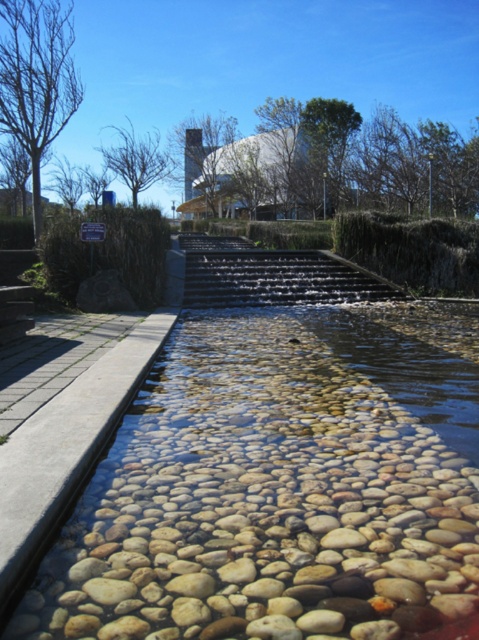
Between point (257, 508) and point (237, 236), which one is positioned in front?

Positioned in front is point (257, 508).

Between point (216, 417) and point (182, 234), which one is positioned behind?

The point (182, 234) is behind.

Who is more forward, (120, 557) or (283, 253)?

Point (120, 557) is in front.

Where is `translucent pebbles at center`? This screenshot has height=640, width=479. translucent pebbles at center is located at coordinates (273, 492).

Is black stone stairs at center thinner than smooth concrete stairs at lower left?

In fact, black stone stairs at center might be wider than smooth concrete stairs at lower left.

Where is `black stone stairs at center`? This screenshot has width=479, height=640. black stone stairs at center is located at coordinates (x=273, y=275).

Identify the location of black stone stairs at center. Image resolution: width=479 pixels, height=640 pixels. (273, 275).

Who is shorter, translucent pebbles at center or smooth concrete stairs at lower left?

Standing shorter between the two is translucent pebbles at center.

Between translucent pebbles at center and smooth concrete stairs at lower left, which one is positioned higher?

Positioned higher is smooth concrete stairs at lower left.

Does point (237, 612) come closer to viewer compared to point (0, 276)?

Yes, it is.

You are a GUI agent. You are given a task and a screenshot of the screen. Output one action in this format:
    pyautogui.click(x=<x>, y=<y>)
    Task: Click on the translucent pebbles at center
    The image size is (479, 640).
    Given the screenshot: What is the action you would take?
    pyautogui.click(x=273, y=492)